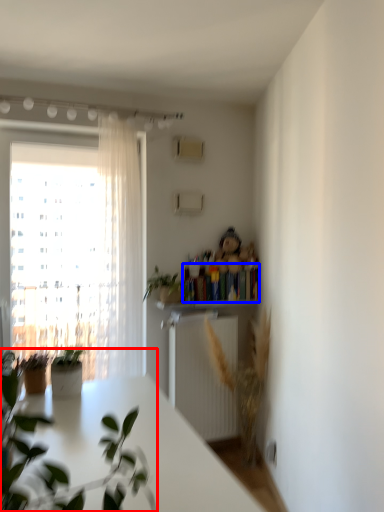
Question: Among these objects, which one is nearest to the camera, houseplant (highlighted by a red box) or book (highlighted by a blue box)?

Choices:
 (A) houseplant
 (B) book

Answer: (A)